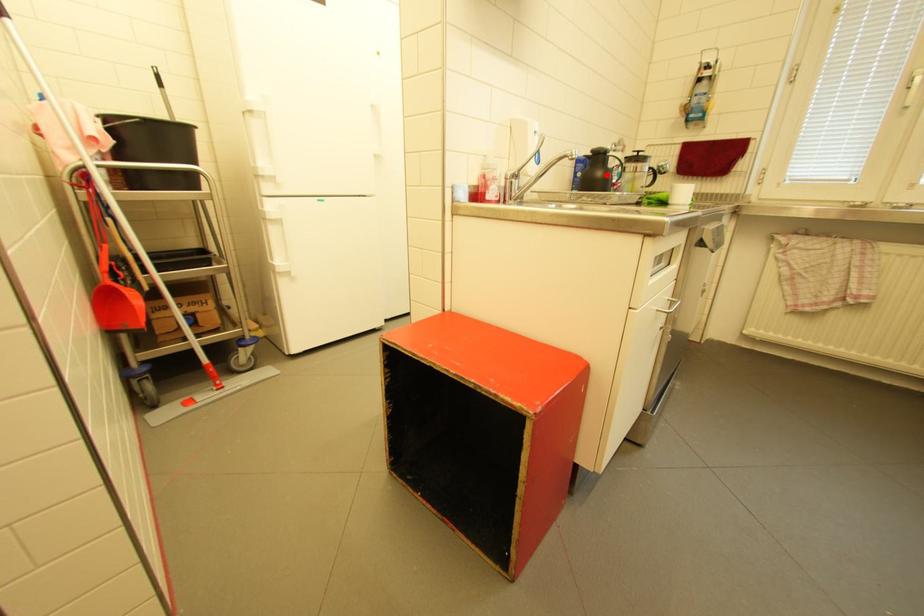
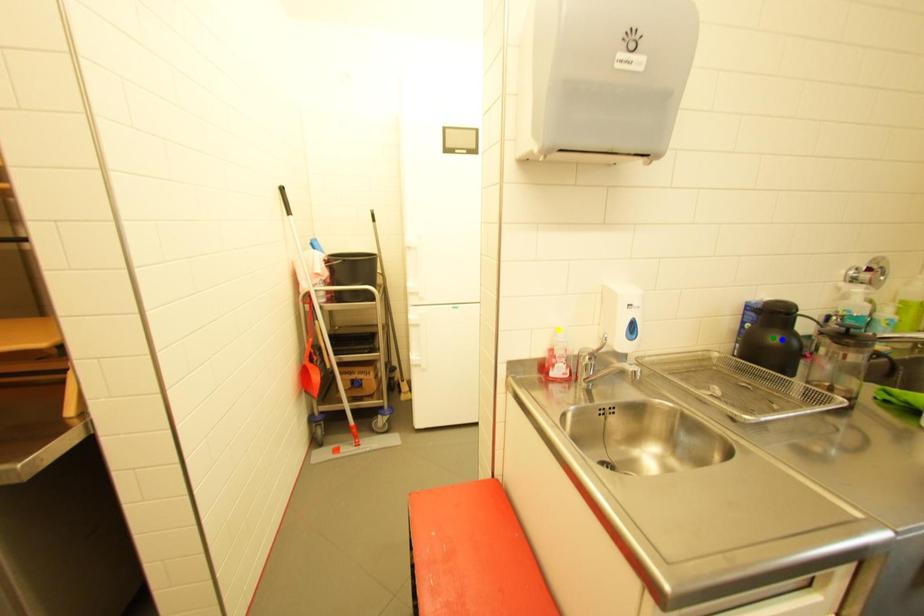
Question: I am providing you with two images of the same scene from different viewpoints. A red point is marked on the first image. You are given multiple points on the second image. Can you choose the point in image 2 that corresponds to the point in image 1?

Choices:
 (A) yellow point
 (B) blue point
 (C) green point

Answer: (B)